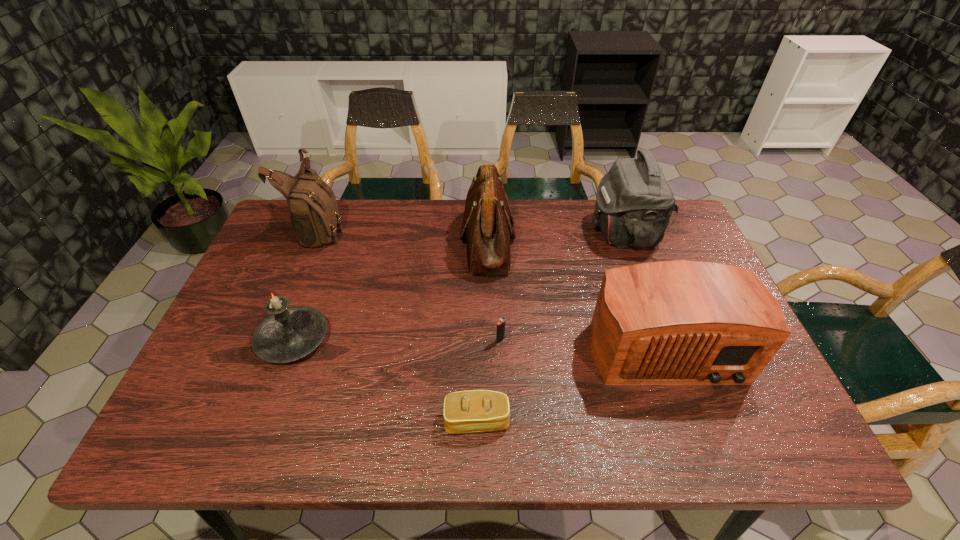
Image resolution: width=960 pixels, height=540 pixels. I want to click on empty space that is in between the leftmost shoulder bag and the radio receiver, so click(492, 285).

At what (x,y) coordinates should I click in order to perform the action: click on free area in between the igniter and the second shoulder bag from left to right. Please return your answer as a coordinate pair (x, y). Looking at the image, I should click on click(494, 291).

The width and height of the screenshot is (960, 540). Identify the location of empty space between the leftmost shoulder bag and the sixth tallest object. (411, 284).

This screenshot has width=960, height=540. In order to click on empty space between the leftmost shoulder bag and the shortest object in this screenshot , I will do `click(399, 324)`.

The height and width of the screenshot is (540, 960). In order to click on free space that is in between the sixth tallest object and the radio receiver in this screenshot , I will do `click(581, 341)`.

The width and height of the screenshot is (960, 540). Identify the location of free space between the sixth tallest object and the clutch bag. (489, 380).

Select which object appears as the closest to the fifth tallest object. Please provide its 2D coordinates. Your answer should be formatted as a tuple, i.e. [(x, y)], where the tuple contains the x and y coordinates of a point satisfying the conditions above.

[(314, 214)]

At what (x,y) coordinates should I click in order to perform the action: click on object that is the fourth closest to the rightmost shoulder bag. Please return your answer as a coordinate pair (x, y). Looking at the image, I should click on [x=468, y=411].

Where is `shoulder bag object that ranks as the second closest to the clutch bag`? The image size is (960, 540). shoulder bag object that ranks as the second closest to the clutch bag is located at coordinates (634, 203).

This screenshot has height=540, width=960. I want to click on shoulder bag that is the second closest to the second shoulder bag from right to left, so click(314, 214).